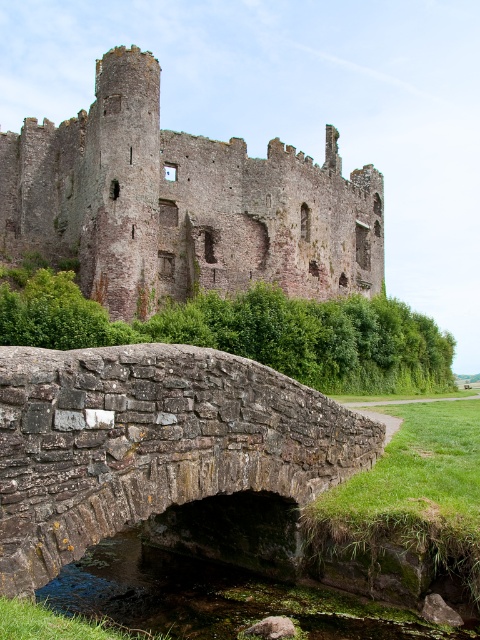
Can you confirm if rustic stone castle at upper center is positioned above rusty stone bridge at center?

Yes.

I want to click on rustic stone castle at upper center, so click(181, 204).

Based on the photo, who is more forward, [305,205] or [226,410]?

Positioned in front is point [226,410].

The image size is (480, 640). Identify the location of rustic stone castle at upper center. (181, 204).